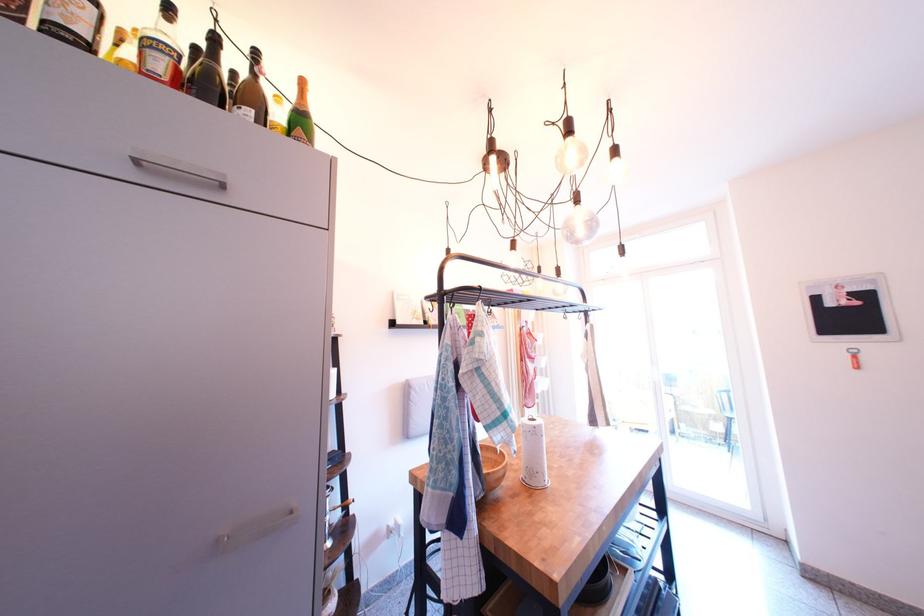
Locate an element on the screen. This screenshot has height=616, width=924. green champagne bottle is located at coordinates (300, 116).